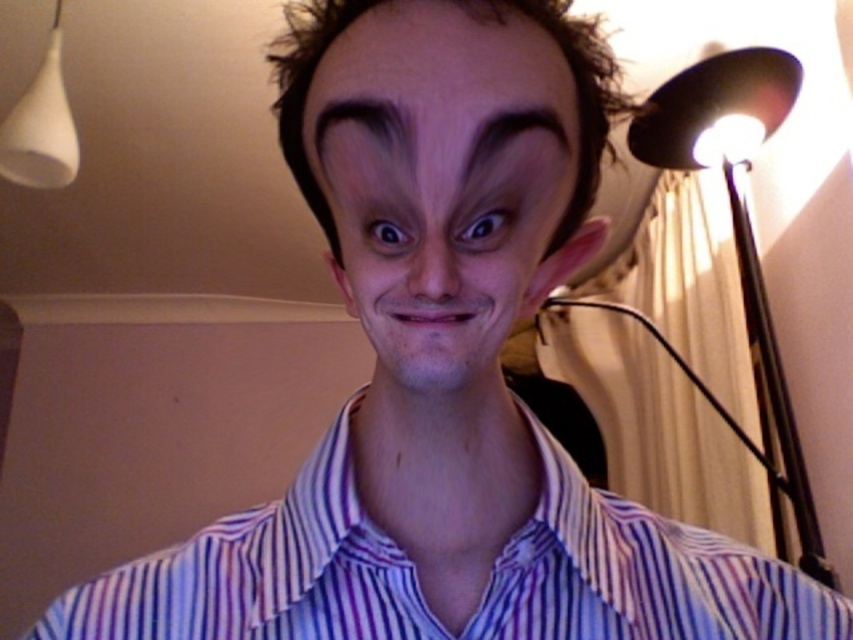
Consider the image. You are a photographer setting up a portrait. You notice the black metal floor lamp at right and the brown glossy eye at center. Which object is positioned to the right side of the frame?

The black metal floor lamp at right is positioned to the right side of the frame, as it is to the right of the brown glossy eye at center.

You are a photographer adjusting the camera focus. The camera has a depth of field that can only focus on objects within a 2 inch range. You want to capture both the dark purple hair at center and the black matte eye at center in sharp focus. Is this possible?

The dark purple hair at center and black matte eye at center are 1.99 inches apart from each other, so yes, they can both be in sharp focus since the distance between them is within the camera s 2 inch depth of field range.